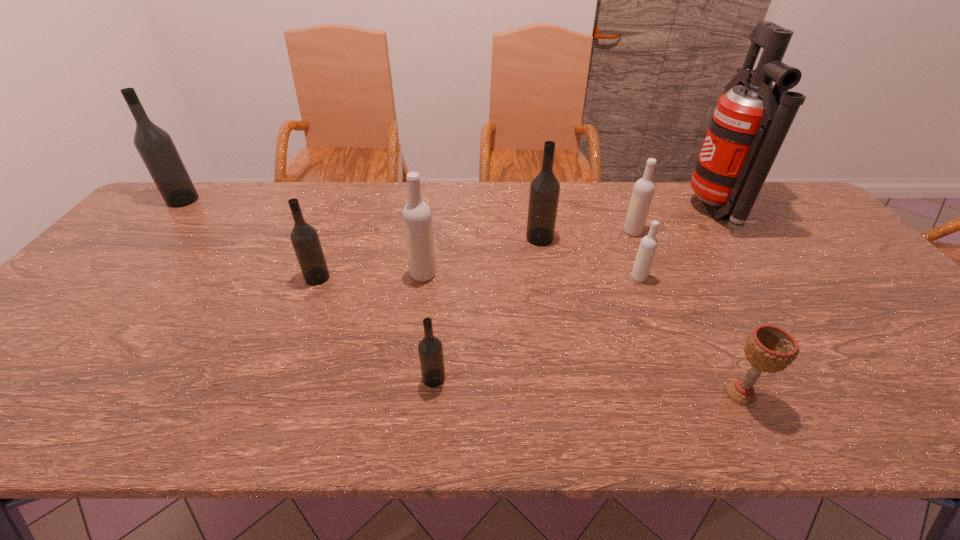
In order to click on free area in between the rightmost object and the farthest white vodka in this screenshot , I will do `click(674, 221)`.

At what (x,y) coordinates should I click in order to perform the action: click on vacant space that is in between the rightmost black vodka and the beige chalice. Please return your answer as a coordinate pair (x, y). Image resolution: width=960 pixels, height=540 pixels. Looking at the image, I should click on (640, 316).

Where is `empty space between the smallest white vodka and the tallest object`? The height and width of the screenshot is (540, 960). empty space between the smallest white vodka and the tallest object is located at coordinates (677, 244).

What are the coordinates of `free spot between the farthest vodka and the third biggest black vodka` in the screenshot? It's located at (250, 239).

Locate which object is the fifth closest to the leftmost black vodka. Please provide its 2D coordinates. Your answer should be formatted as a tuple, i.e. [(x, y)], where the tuple contains the x and y coordinates of a point satisfying the conditions above.

[(644, 188)]

Identify which object is located as the sixth nearest to the sixth vodka from right to left. Please provide its 2D coordinates. Your answer should be formatted as a tuple, i.e. [(x, y)], where the tuple contains the x and y coordinates of a point satisfying the conditions above.

[(644, 188)]

The image size is (960, 540). Identify the location of vodka that is the sixth closest one to the beige chalice. (305, 240).

Find the location of a particular element. vodka object that ranks as the closest to the farthest white vodka is located at coordinates tap(648, 245).

The width and height of the screenshot is (960, 540). Identify the location of black vodka that is the second closest to the third black vodka from right to left. (544, 190).

Where is `black vodka that is the fourth closest to the fire extinguisher`? This screenshot has width=960, height=540. black vodka that is the fourth closest to the fire extinguisher is located at coordinates (155, 146).